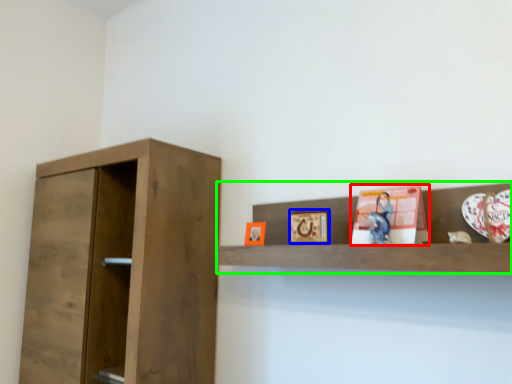
Question: Considering the real-world distances, which object is closest to book (highlighted by a red box)? picture frame (highlighted by a blue box) or shelf (highlighted by a green box).

Choices:
 (A) picture frame
 (B) shelf

Answer: (B)